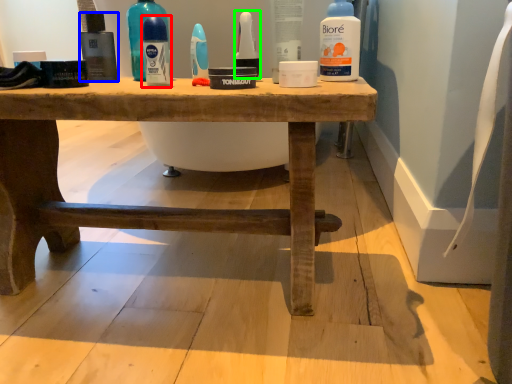
Question: Which object is positioned farthest from mouthwash (highlighted by a red box)? Select from mouthwash (highlighted by a blue box) and mouthwash (highlighted by a green box).

Choices:
 (A) mouthwash
 (B) mouthwash

Answer: (B)